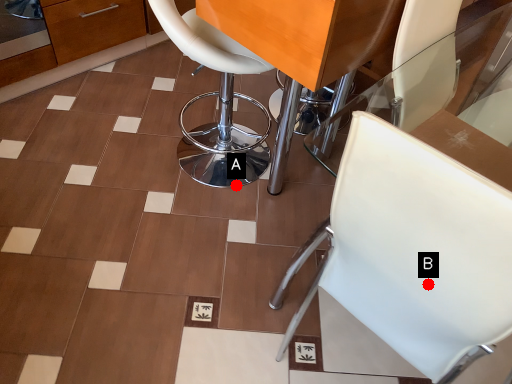
Question: Two points are circled on the image, labeled by A and B beside each circle. Which point is closer to the camera?

Choices:
 (A) A is closer
 (B) B is closer

Answer: (B)